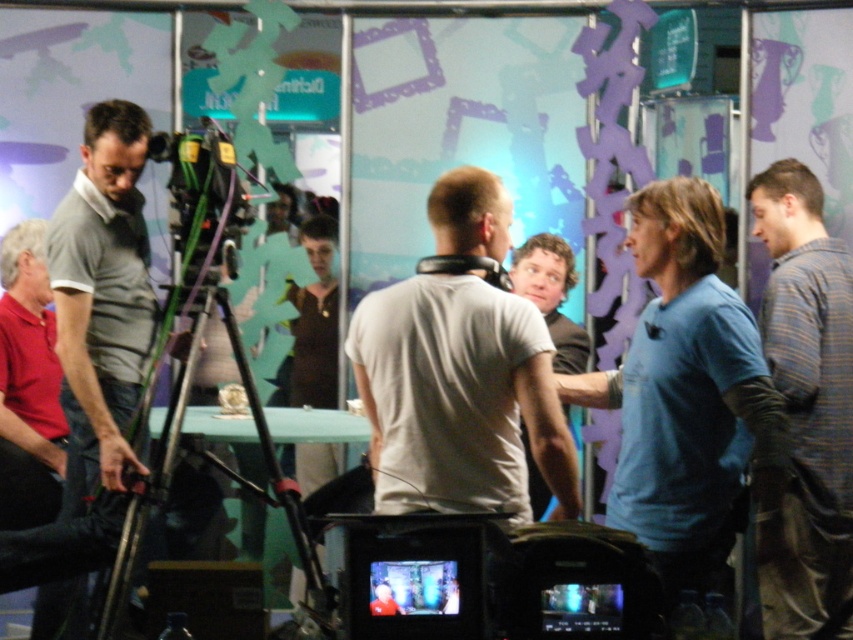
You are an actor waiting for your cue and are standing behind the black metal tripod at center. You need to quickly signal to the person in the plaid shirt at right. Can you see them directly without moving from your current position?

The plaid shirt at right is further to the viewer than the black metal tripod at center, so yes, you can see them directly since they are closer to you and not blocked by the tripod.

You are standing at the point labeled as point (216, 288) and want to move to the point labeled as point (799, 260). According to the scene description, which direction should you move to reach your destination?

You should move backward to reach point (799, 260) because it is behind point (216, 288).